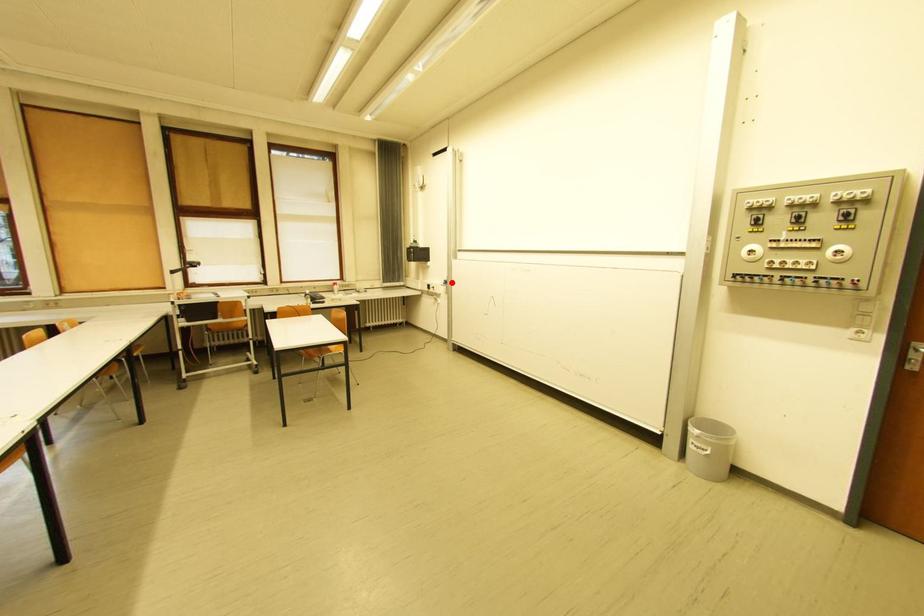
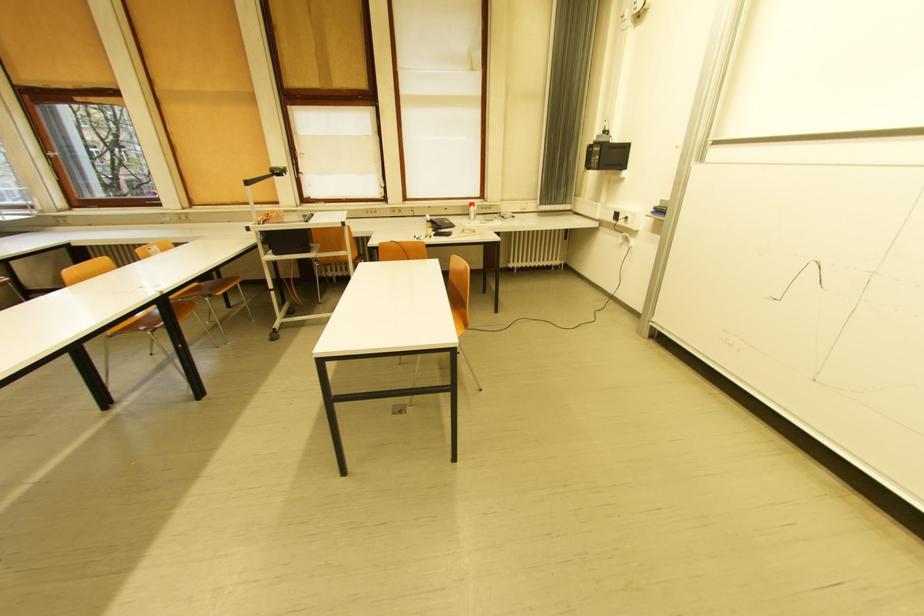
Question: I am providing you with two images of the same scene from different viewpoints. A red point is marked on the first image. Can you still see the location of the red point in image 2?

Choices:
 (A) Yes
 (B) No

Answer: (A)